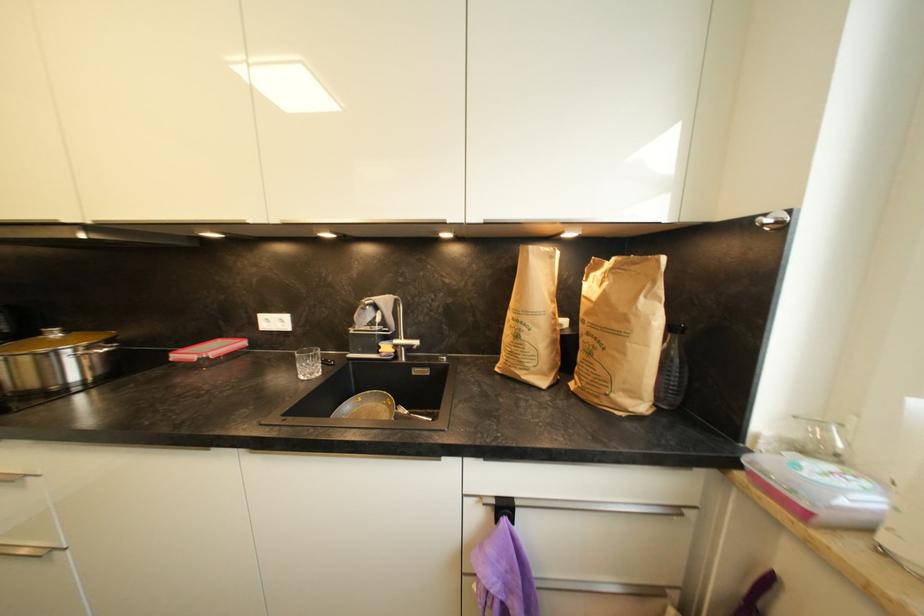
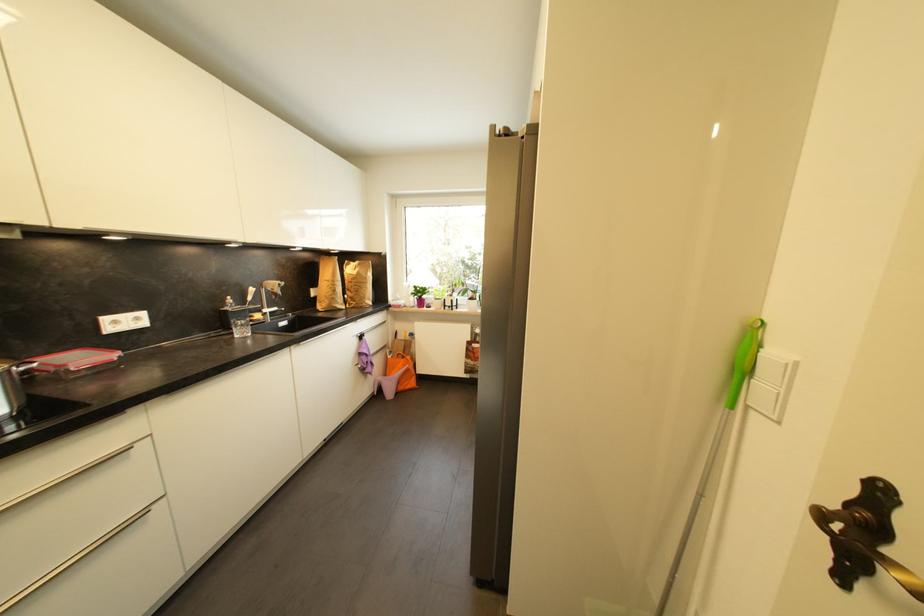
Locate, in the second image, the point that corresponds to point 239,339 in the first image.

(54, 355)